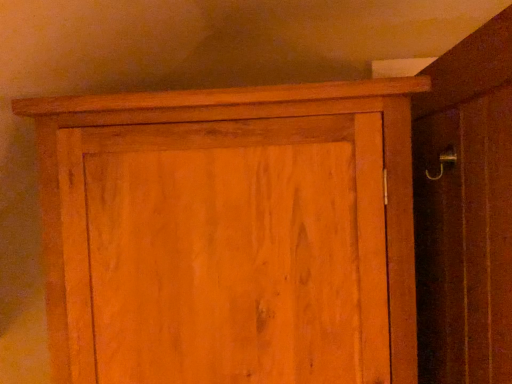
In order to click on wooden screen door at right in this screenshot , I will do `click(465, 240)`.

What do you see at coordinates (465, 240) in the screenshot? I see `wooden screen door at right` at bounding box center [465, 240].

The image size is (512, 384). Find the location of `wooden cupboard at upper center`. wooden cupboard at upper center is located at coordinates (231, 234).

This screenshot has height=384, width=512. What do you see at coordinates (231, 234) in the screenshot?
I see `wooden cupboard at upper center` at bounding box center [231, 234].

I want to click on wooden screen door at right, so click(465, 240).

Would you say wooden cupboard at upper center is to the left or to the right of wooden screen door at right in the picture?

In the image, wooden cupboard at upper center appears on the left side of wooden screen door at right.

From the picture: Who is more distant, wooden cupboard at upper center or wooden screen door at right?

wooden cupboard at upper center is behind.

Does point (353, 217) lie in front of point (501, 254)?

No, it is behind (501, 254).

From the image's perspective, which one is positioned higher, wooden cupboard at upper center or wooden screen door at right?

wooden screen door at right is shown above in the image.

From a real-world perspective, which is physically below, wooden cupboard at upper center or wooden screen door at right?

wooden cupboard at upper center.

Can you confirm if wooden cupboard at upper center is thinner than wooden screen door at right?

Incorrect, the width of wooden cupboard at upper center is not less than that of wooden screen door at right.

In terms of height, does wooden cupboard at upper center look taller or shorter compared to wooden screen door at right?

wooden cupboard at upper center is shorter than wooden screen door at right.

Who is bigger, wooden cupboard at upper center or wooden screen door at right?

Bigger between the two is wooden cupboard at upper center.

Is wooden cupboard at upper center inside the boundaries of wooden screen door at right, or outside?

wooden cupboard at upper center is spatially situated outside wooden screen door at right.

From the picture: Is wooden cupboard at upper center in contact with wooden screen door at right?

No, wooden cupboard at upper center is not making contact with wooden screen door at right.

Is wooden screen door at right at the back of wooden cupboard at upper center?

No.

Measure the distance between wooden cupboard at upper center and wooden screen door at right.

wooden cupboard at upper center is 14.07 inches from wooden screen door at right.

Identify the location of cupboard lying on the left of wooden screen door at right. pyautogui.click(x=231, y=234).

Considering the relative positions of wooden screen door at right and wooden cupboard at upper center in the image provided, is wooden screen door at right to the left or to the right of wooden cupboard at upper center?

Clearly, wooden screen door at right is on the right of wooden cupboard at upper center in the image.

Is the position of wooden screen door at right less distant than that of wooden cupboard at upper center?

Yes.

Is point (497, 356) closer or farther from the camera than point (404, 319)?

Point (497, 356).

From the image's perspective, who appears lower, wooden screen door at right or wooden cupboard at upper center?

wooden cupboard at upper center is shown below in the image.

From a real-world perspective, does wooden screen door at right sit lower than wooden cupboard at upper center?

Incorrect, from a real-world perspective, wooden screen door at right is higher than wooden cupboard at upper center.

Which of these two, wooden screen door at right or wooden cupboard at upper center, is thinner?

wooden screen door at right.

Does wooden screen door at right have a lesser height compared to wooden cupboard at upper center?

No.

Between wooden screen door at right and wooden cupboard at upper center, which one has larger size?

wooden cupboard at upper center is bigger.

Can we say wooden screen door at right lies outside wooden cupboard at upper center?

wooden screen door at right is positioned outside wooden cupboard at upper center.

Would you say wooden screen door at right is a long distance from wooden cupboard at upper center?

wooden screen door at right is actually quite close to wooden cupboard at upper center.

Is wooden screen door at right looking in the opposite direction of wooden cupboard at upper center?

Yes, wooden cupboard at upper center is at the back of wooden screen door at right.

You are a GUI agent. You are given a task and a screenshot of the screen. Output one action in this format:
    pyautogui.click(x=<x>, y=<y>)
    Task: Click on the cupboard below the wooden screen door at right (from a real-world perspective)
    
    Given the screenshot: What is the action you would take?
    pyautogui.click(x=231, y=234)

Locate an element on the screen. Image resolution: width=512 pixels, height=384 pixels. cupboard that is on the left side of wooden screen door at right is located at coordinates (231, 234).

Identify the location of screen door in front of the wooden cupboard at upper center. (465, 240).